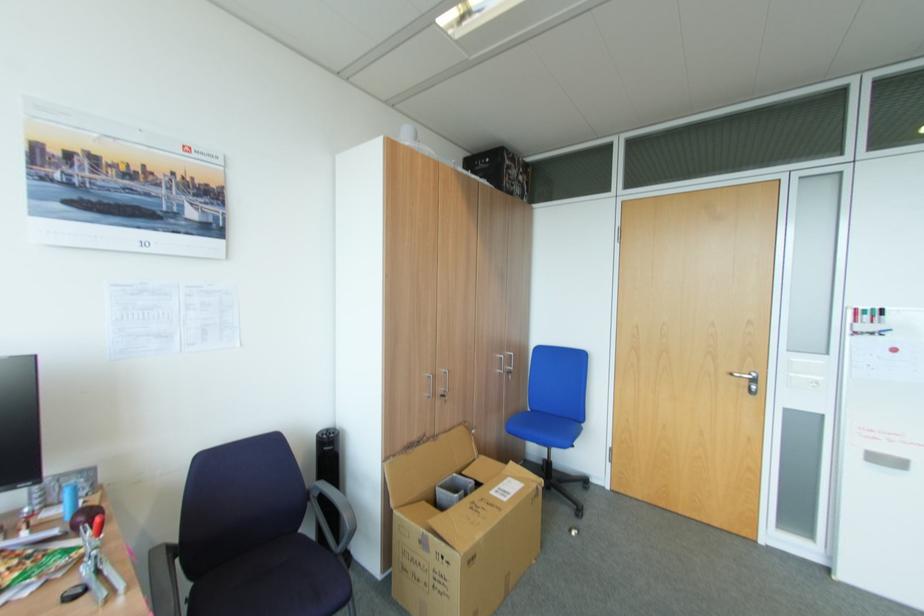
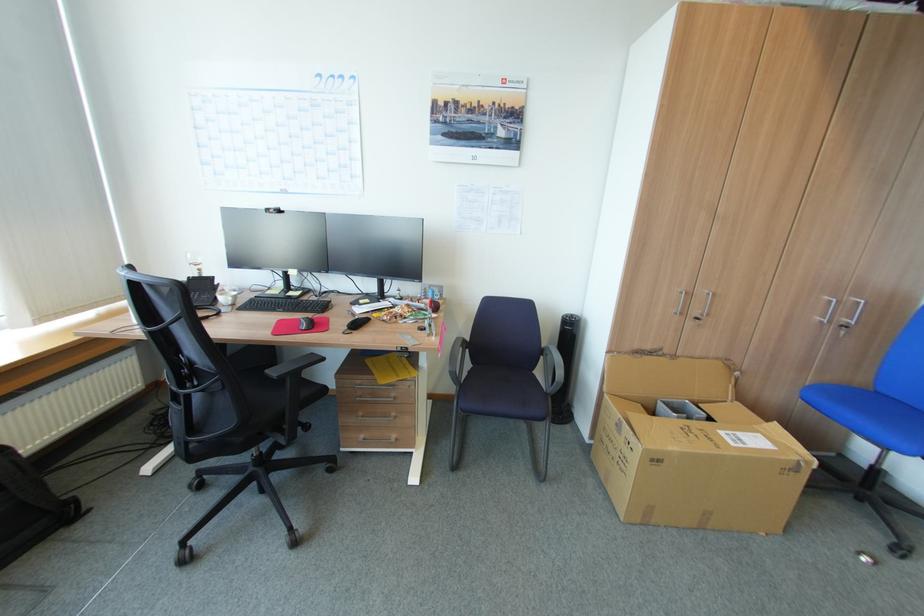
How did the camera likely rotate?

The camera's rotation is toward left-down.